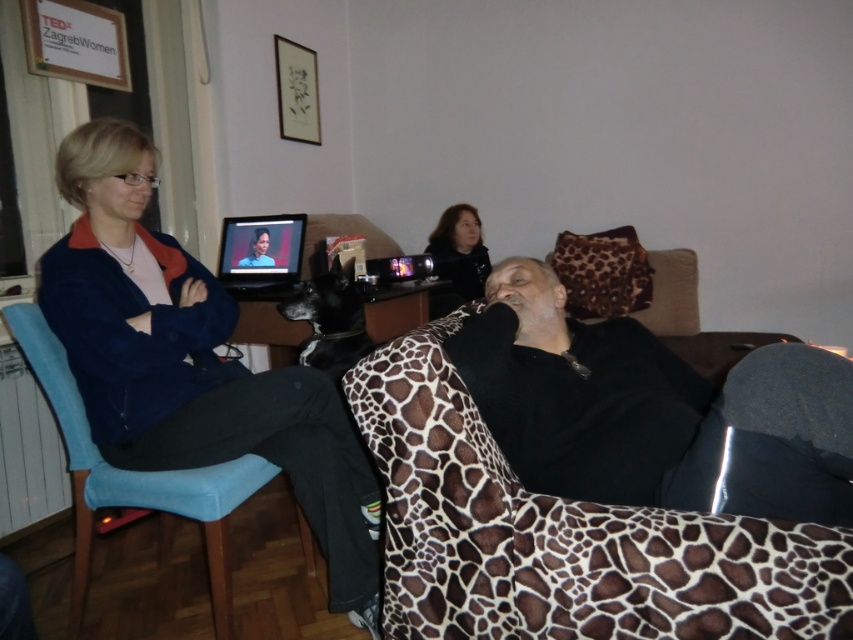
You are standing in the room and want to place a small plant on the surface between the matte blue jacket at left and the blue fabric chair at left. Is there enough space for the plant?

The matte blue jacket at left is above the blue fabric chair at left, so there is space between them to place the small plant.

You are a delivery robot with a package that needs to be placed between the black matte shirt at center and the smooth black hair at center. The package is 1.8 meters long. Can you fit the package between them?

The distance between the black matte shirt at center and the smooth black hair at center is 1.77 meters. Since the package is 1.8 meters long, it cannot fit between them as the space is slightly shorter than the package.